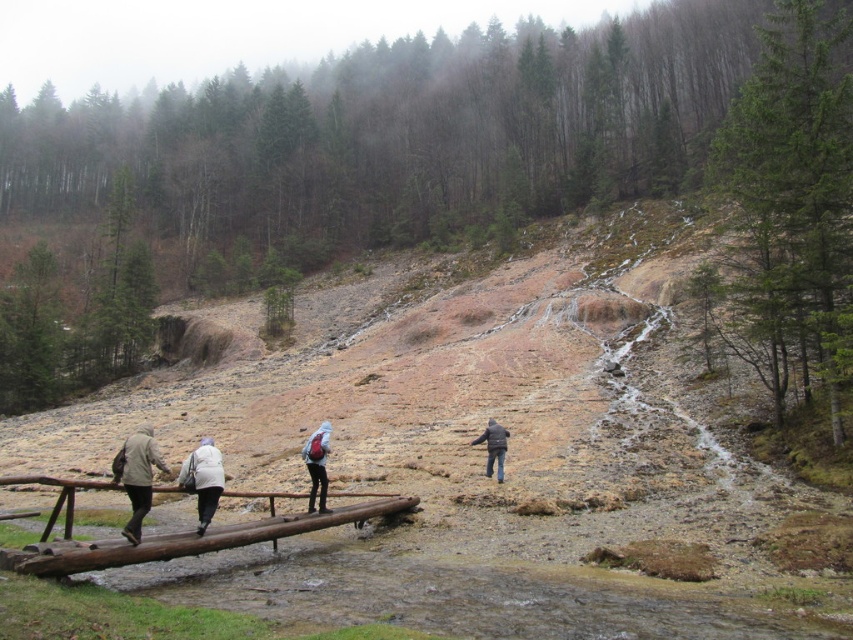
Question: Which point appears closest to the camera in this image?

Choices:
 (A) (315, 476)
 (B) (132, 440)

Answer: (B)

Question: Is white woolen jacket at center above matte black backpack at center?

Choices:
 (A) yes
 (B) no

Answer: (B)

Question: Which object appears farthest from the camera in this image?

Choices:
 (A) matte black backpack at center
 (B) light brown leather jacket at lower left

Answer: (A)

Question: Which point is closer to the camera taking this photo?

Choices:
 (A) (323, 476)
 (B) (492, 428)

Answer: (A)

Question: Can you confirm if light brown leather jacket at lower left is positioned to the right of dark brown leather jacket at center?

Choices:
 (A) no
 (B) yes

Answer: (A)

Question: Can you confirm if light brown leather jacket at lower left is thinner than dark brown leather jacket at center?

Choices:
 (A) yes
 (B) no

Answer: (B)